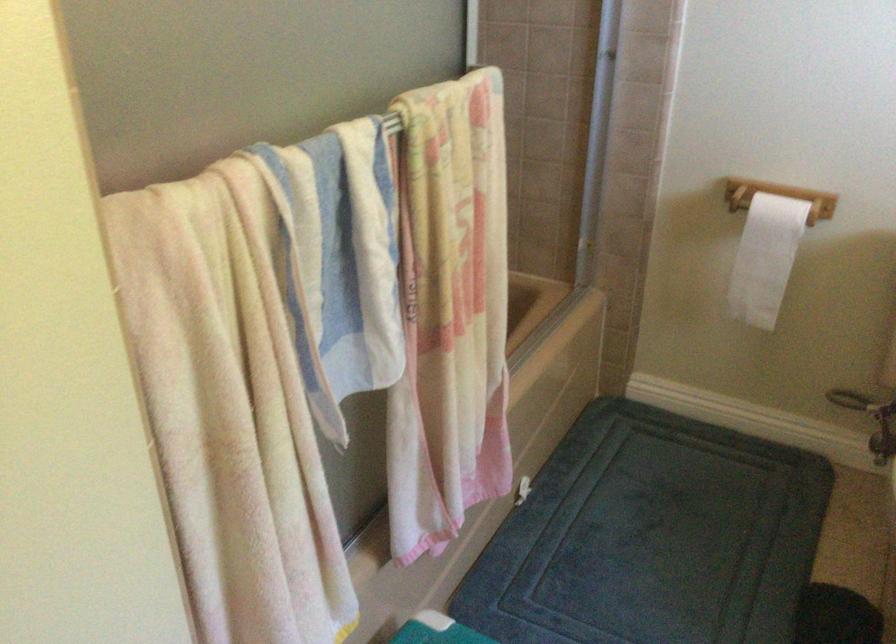
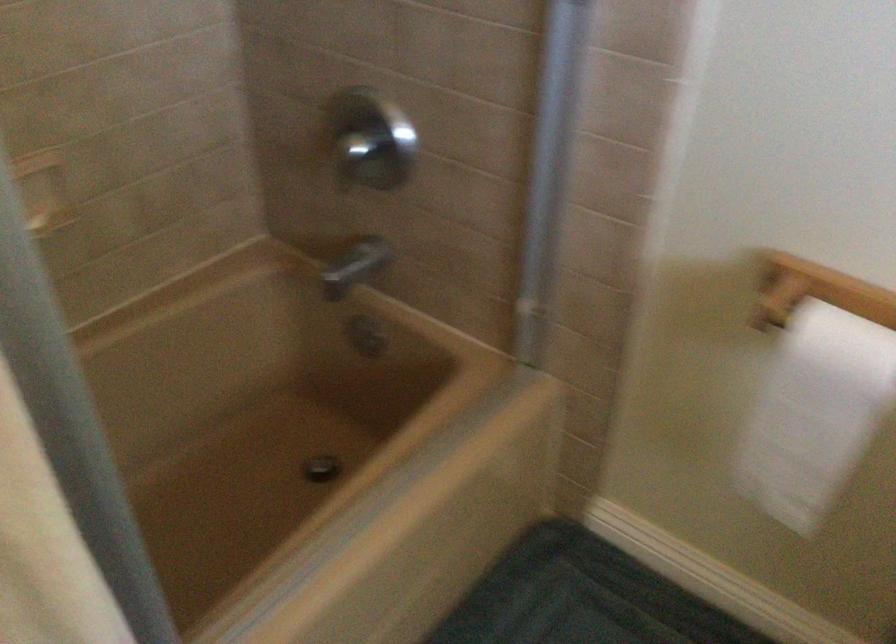
In a continuous first-person perspective shot, in which direction is the camera moving?

The cameraman walked toward right, forward.